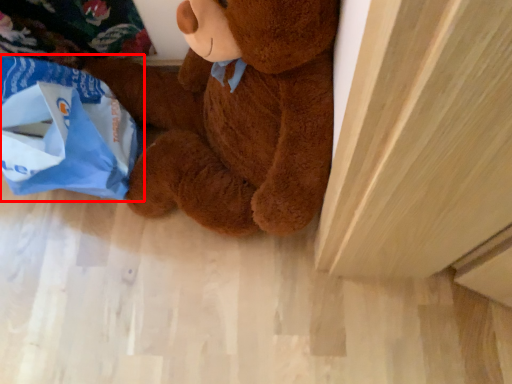
Question: From the image's perspective, where is grocery bag (annotated by the red box) located relative to teddy bear?

Choices:
 (A) below
 (B) above

Answer: (A)